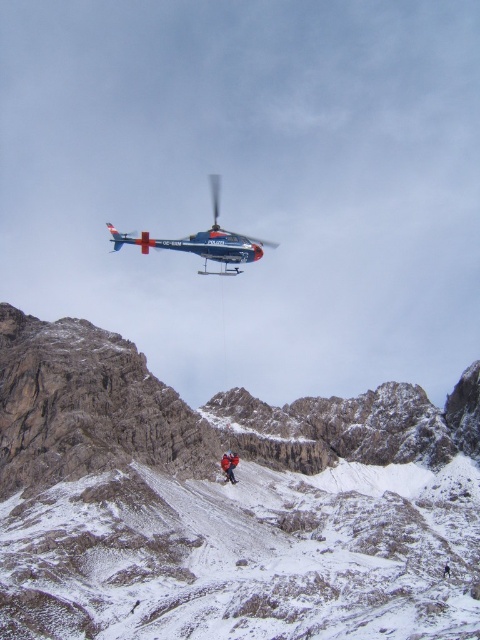
Based on the photo, you are a rescue worker in the snowy rocky mountain at center and need to signal the polished metallic helicopter at upper center. Since the helicopter is above you, which direction should you look to make eye contact with the pilot?

The snowy rocky mountain at center is located below the polished metallic helicopter at upper center, so you should look upward to make eye contact with the pilot.

You are a rescue worker in the red fabric jacket at center. You need to signal the polished metallic helicopter at upper center. Considering their relative sizes, which object is larger and would be easier to see from a distance?

The polished metallic helicopter at upper center is taller than the red fabric jacket at center, making it the larger object and easier to see from a distance.